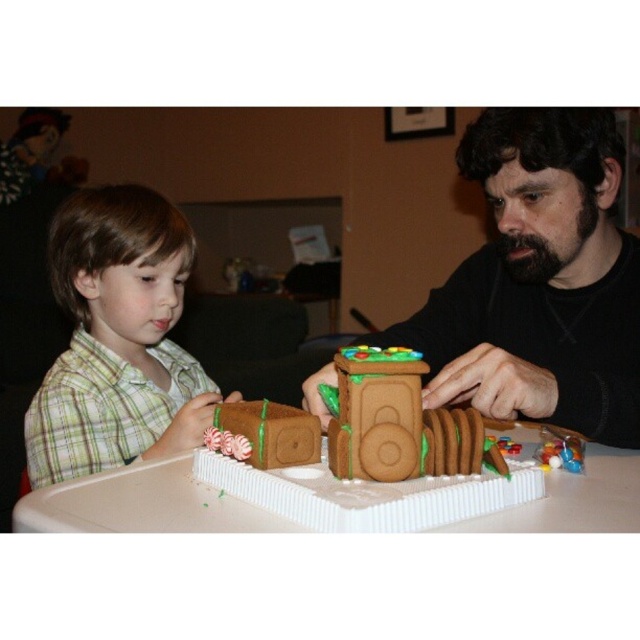
Question: Does brown sugar cookie train at center lie behind brown sugar cookie at center?

Choices:
 (A) no
 (B) yes

Answer: (A)

Question: Which point is farther to the camera?

Choices:
 (A) (534, 269)
 (B) (152, 237)
 (C) (262, 449)

Answer: (B)

Question: Which of the following is the closest to the observer?

Choices:
 (A) black matte gingerbread house at right
 (B) brown sugar cookie train at center

Answer: (B)

Question: Can you confirm if black matte gingerbread house at right is thinner than brown sugar cookie train at center?

Choices:
 (A) yes
 (B) no

Answer: (B)

Question: Is the position of black matte gingerbread house at right more distant than that of brown sugar cookie at center?

Choices:
 (A) no
 (B) yes

Answer: (B)

Question: Which point is farther to the camera?

Choices:
 (A) (397, 394)
 (B) (74, 204)

Answer: (B)